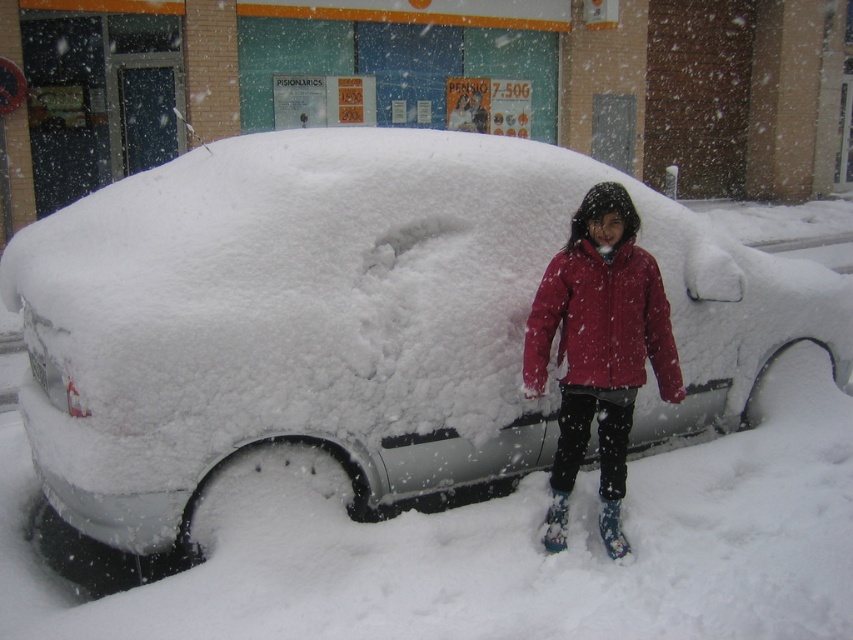
Is matte red jacket at center thinner than blue rubber ski boot at lower center?

In fact, matte red jacket at center might be wider than blue rubber ski boot at lower center.

Can you confirm if matte red jacket at center is positioned to the left of blue rubber ski boot at lower center?

In fact, matte red jacket at center is to the right of blue rubber ski boot at lower center.

You are a GUI agent. You are given a task and a screenshot of the screen. Output one action in this format:
    pyautogui.click(x=<x>, y=<y>)
    Task: Click on the matte red jacket at center
    
    Given the screenshot: What is the action you would take?
    pyautogui.click(x=602, y=323)

You are a GUI agent. You are given a task and a screenshot of the screen. Output one action in this format:
    pyautogui.click(x=<x>, y=<y>)
    Task: Click on the matte red jacket at center
    
    Given the screenshot: What is the action you would take?
    pyautogui.click(x=602, y=323)

Is white matte car at center below red fleece jacket at center?

Actually, white matte car at center is above red fleece jacket at center.

Which is more to the left, white matte car at center or red fleece jacket at center?

Positioned to the left is white matte car at center.

Who is more forward, (341, 260) or (622, 285)?

Point (341, 260)

You are a GUI agent. You are given a task and a screenshot of the screen. Output one action in this format:
    pyautogui.click(x=<x>, y=<y>)
    Task: Click on the white matte car at center
    The width and height of the screenshot is (853, 640).
    Given the screenshot: What is the action you would take?
    [x=352, y=317]

Can you confirm if matte red jacket at center is positioned above blue fabric ski boot at lower center?

Correct, matte red jacket at center is located above blue fabric ski boot at lower center.

Locate an element on the screen. matte red jacket at center is located at coordinates (602, 323).

Who is more forward, (589, 284) or (602, 508)?

Point (589, 284) is in front.

Where is `matte red jacket at center`? matte red jacket at center is located at coordinates (602, 323).